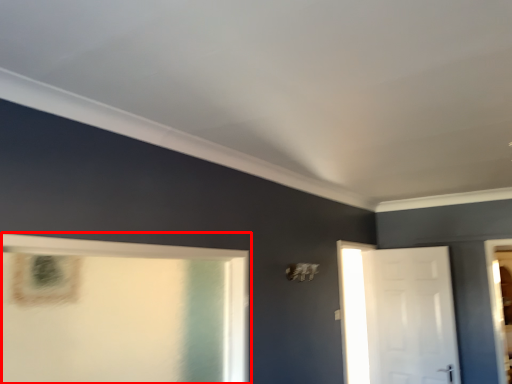
Question: Where is window (annotated by the red box) located in relation to door in the image?

Choices:
 (A) right
 (B) left

Answer: (B)